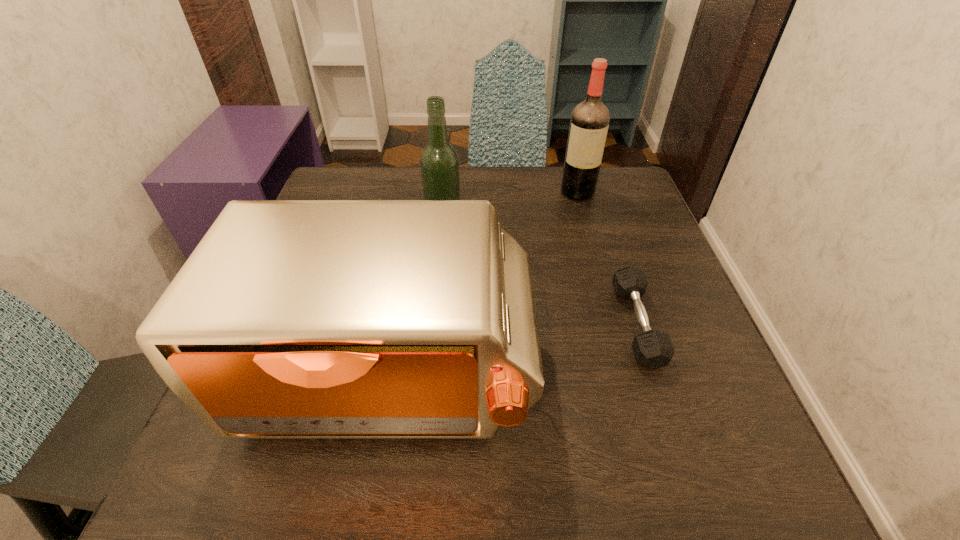
Locate an element on the screen. Image resolution: width=960 pixels, height=540 pixels. the farther liquor is located at coordinates (589, 123).

At what (x,y) coordinates should I click in order to perform the action: click on the farthest object. Please return your answer as a coordinate pair (x, y). The height and width of the screenshot is (540, 960). Looking at the image, I should click on (x=589, y=123).

You are a GUI agent. You are given a task and a screenshot of the screen. Output one action in this format:
    pyautogui.click(x=<x>, y=<y>)
    Task: Click on the second farthest object
    The image size is (960, 540).
    Given the screenshot: What is the action you would take?
    pyautogui.click(x=439, y=162)

Find the location of a particular element. the left liquor is located at coordinates (439, 162).

This screenshot has width=960, height=540. Identify the location of toaster oven. (292, 319).

At what (x,y) coordinates should I click in order to perform the action: click on the shortest object. Please return your answer as a coordinate pair (x, y). Looking at the image, I should click on (652, 348).

This screenshot has width=960, height=540. I want to click on vacant space located 0.260m on the front-facing side of the right liquor, so click(x=601, y=273).

Where is `vacant area situated on the front of the second farthest object`? This screenshot has width=960, height=540. vacant area situated on the front of the second farthest object is located at coordinates (441, 267).

Locate an element on the screen. The height and width of the screenshot is (540, 960). vacant space located 0.200m on the back of the dumbbell is located at coordinates (604, 224).

Locate an element on the screen. The image size is (960, 540). object that is at the near edge is located at coordinates (292, 319).